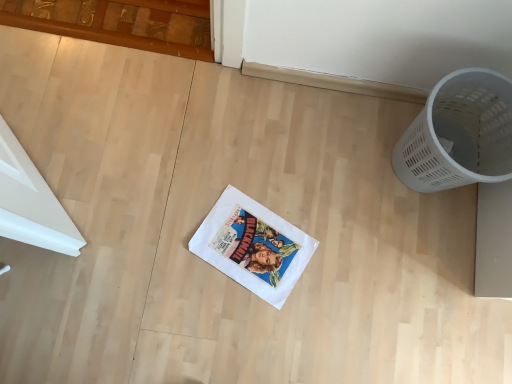
The width and height of the screenshot is (512, 384). What do you see at coordinates (253, 246) in the screenshot?
I see `white paper comic book at center` at bounding box center [253, 246].

Find the location of a particular element. white paper comic book at center is located at coordinates (253, 246).

Image resolution: width=512 pixels, height=384 pixels. What do you see at coordinates (459, 134) in the screenshot?
I see `white plastic basket at right` at bounding box center [459, 134].

Image resolution: width=512 pixels, height=384 pixels. What are the coordinates of `white plastic basket at right` in the screenshot? It's located at (459, 134).

In order to face white plastic basket at right, should I rotate leftwards or rightwards?

You should rotate right by 25.179 degrees.

Measure the distance between point (398,159) and camera.

Point (398,159) and camera are 1.14 meters apart from each other.

Identify the location of white paper comic book at center. This screenshot has height=384, width=512. (253, 246).

Considering the positions of objects white paper comic book at center and white plastic basket at right in the image provided, who is more to the left, white paper comic book at center or white plastic basket at right?

Positioned to the left is white paper comic book at center.

Between white paper comic book at center and white plastic basket at right, which one is positioned behind?

white paper comic book at center is more distant.

Is point (265, 245) in front of point (393, 161)?

Yes, point (265, 245) is in front of point (393, 161).

From the image's perspective, between white paper comic book at center and white plastic basket at right, who is located below?

From the image's view, white paper comic book at center is below.

From a real-world perspective, is white paper comic book at center located higher than white plastic basket at right?

Incorrect, from a real-world perspective, white paper comic book at center is lower than white plastic basket at right.

Considering the sizes of objects white paper comic book at center and white plastic basket at right in the image provided, who is thinner, white paper comic book at center or white plastic basket at right?

Thinner between the two is white paper comic book at center.

Considering the sizes of white paper comic book at center and white plastic basket at right in the image, is white paper comic book at center taller or shorter than white plastic basket at right?

Clearly, white paper comic book at center is shorter compared to white plastic basket at right.

Looking at the image, does white paper comic book at center seem bigger or smaller compared to white plastic basket at right?

Clearly, white paper comic book at center is smaller in size than white plastic basket at right.

Is white plastic basket at right inside white paper comic book at center?

No, white plastic basket at right is not surrounded by white paper comic book at center.

Can you see white paper comic book at center touching white plastic basket at right?

No.

Is white paper comic book at center facing away from white plastic basket at right?

white paper comic book at center does not have its back to white plastic basket at right.

How many degrees apart are the facing directions of white paper comic book at center and white plastic basket at right?

The angle between the facing direction of white paper comic book at center and the facing direction of white plastic basket at right is 25.3 degrees.

I want to click on comic book below the white plastic basket at right (from the image's perspective), so click(253, 246).

Considering the positions of objects white plastic basket at right and white paper comic book at center in the image provided, who is more to the left, white plastic basket at right or white paper comic book at center?

white paper comic book at center is more to the left.

Looking at this image, is white plastic basket at right further to camera compared to white paper comic book at center?

No, white plastic basket at right is closer to the camera.

Between point (454, 90) and point (231, 232), which one is positioned behind?

Positioned behind is point (231, 232).

From the image's perspective, is white plastic basket at right above or below white paper comic book at center?

white plastic basket at right is situated higher than white paper comic book at center in the image.

From a real-world perspective, which object stands above the other?

white plastic basket at right.

Does white plastic basket at right have a lesser width compared to white paper comic book at center?

No, white plastic basket at right is not thinner than white paper comic book at center.

Is white plastic basket at right shorter than white paper comic book at center?

Incorrect, the height of white plastic basket at right does not fall short of that of white paper comic book at center.

Considering the relative sizes of white plastic basket at right and white paper comic book at center in the image provided, is white plastic basket at right bigger than white paper comic book at center?

Yes, white plastic basket at right is bigger than white paper comic book at center.

Do you think white plastic basket at right is within white paper comic book at center, or outside of it?

white plastic basket at right is located beyond the bounds of white paper comic book at center.

Would you consider white plastic basket at right to be distant from white paper comic book at center?

No.

Is white plastic basket at right positioned with its back to white paper comic book at center?

That's not correct — white plastic basket at right is not looking away from white paper comic book at center.

How different are the orientations of white plastic basket at right and white paper comic book at center in degrees?

The angle between the facing direction of white plastic basket at right and the facing direction of white paper comic book at center is 25.3 degrees.

How much distance is there between white plastic basket at right and white paper comic book at center?

white plastic basket at right and white paper comic book at center are 18.26 inches apart.

At what (x,y) coordinates should I click in order to perform the action: click on comic book lying behind the white plastic basket at right. Please return your answer as a coordinate pair (x, y). The height and width of the screenshot is (384, 512). Looking at the image, I should click on (253, 246).

Locate an element on the screen. Image resolution: width=512 pixels, height=384 pixels. comic book below the white plastic basket at right (from the image's perspective) is located at coordinates (253, 246).

Where is `waste container in front of the white paper comic book at center`? The height and width of the screenshot is (384, 512). waste container in front of the white paper comic book at center is located at coordinates (459, 134).